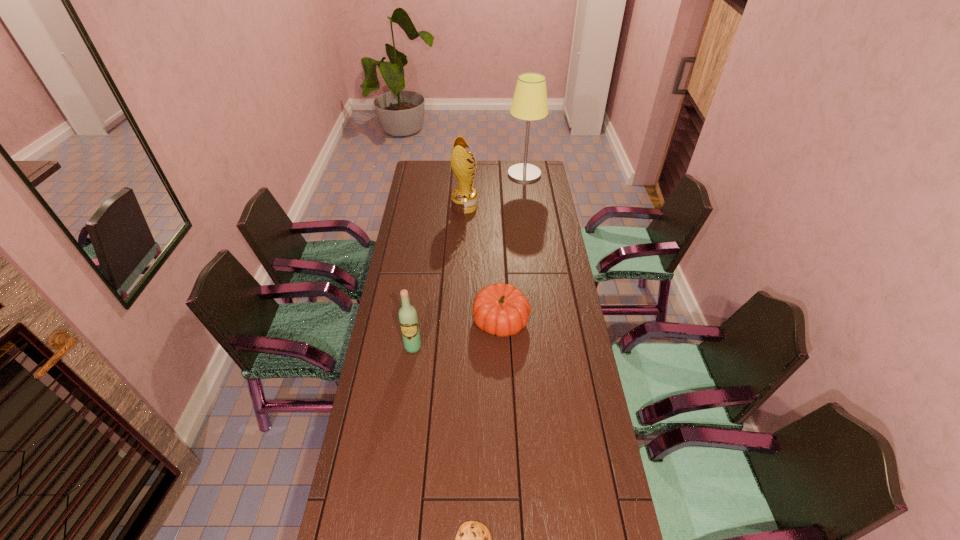
Locate an element on the screen. This screenshot has height=540, width=960. the tallest object is located at coordinates (529, 103).

Locate an element on the screen. the farthest object is located at coordinates (529, 103).

In order to click on the second tallest object in this screenshot , I will do `click(464, 199)`.

Where is `the fourth nearest object`? This screenshot has width=960, height=540. the fourth nearest object is located at coordinates (464, 199).

Locate an element on the screen. The height and width of the screenshot is (540, 960). wine bottle is located at coordinates [408, 319].

Identify the location of the leftmost object. This screenshot has width=960, height=540. (408, 319).

The image size is (960, 540). In order to click on pumpkin in this screenshot , I will do `click(500, 309)`.

Where is `vacant space located 0.370m on the front of the tallest object`? vacant space located 0.370m on the front of the tallest object is located at coordinates (532, 226).

This screenshot has height=540, width=960. In order to click on free space located on the front-facing side of the award in this screenshot , I will do `click(516, 206)`.

You are a GUI agent. You are given a task and a screenshot of the screen. Output one action in this format:
    pyautogui.click(x=<x>, y=<y>)
    Task: Click on the vacant space located 0.230m on the front-facing side of the third shortest object
    Image resolution: width=960 pixels, height=540 pixels.
    Given the screenshot: What is the action you would take?
    pyautogui.click(x=404, y=413)